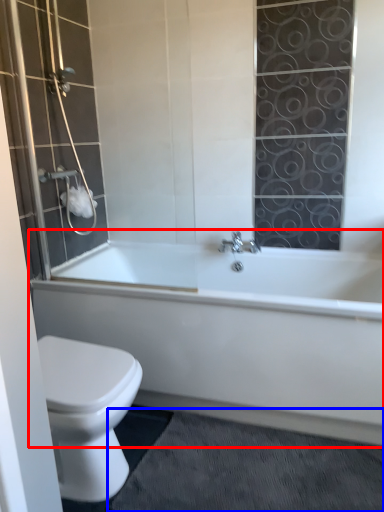
Question: Which object is further to the camera taking this photo, bathtub (highlighted by a red box) or bath mat (highlighted by a blue box)?

Choices:
 (A) bathtub
 (B) bath mat

Answer: (A)